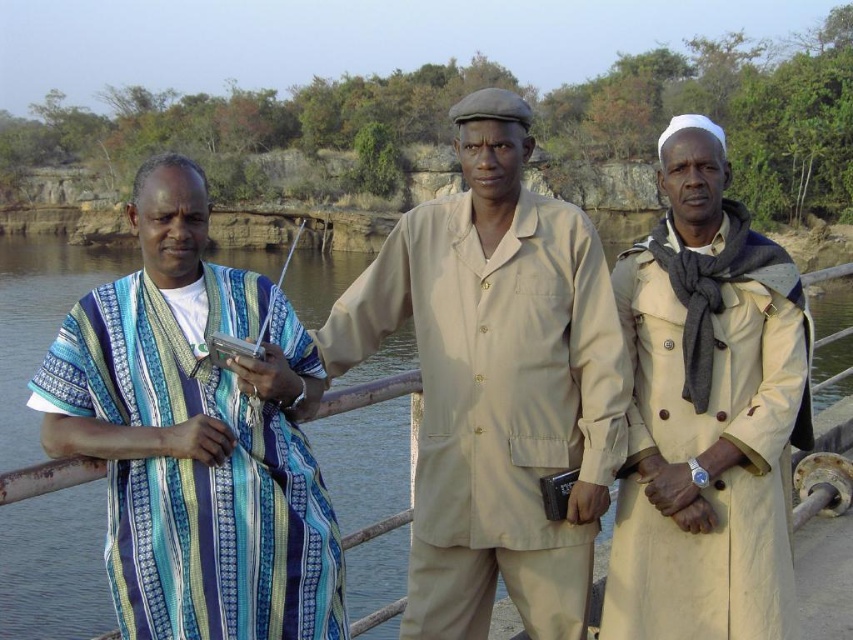
Is beige fabric suit at center thinner than blue striped fabric at left?

Incorrect, beige fabric suit at center's width is not less than blue striped fabric at left's.

Does beige fabric suit at center appear over blue striped fabric at left?

Actually, beige fabric suit at center is below blue striped fabric at left.

I want to click on beige fabric suit at center, so click(497, 384).

Is beige fabric suit at center taller than beige cotton trench coat at right?

Correct, beige fabric suit at center is much taller as beige cotton trench coat at right.

Which is below, beige fabric suit at center or beige cotton trench coat at right?

beige fabric suit at center

Is point (451, 403) positioned after point (695, 148)?

No.

Find the location of a particular element. The image size is (853, 640). beige fabric suit at center is located at coordinates (497, 384).

Between blue striped fabric at left and beige cotton trench coat at right, which one has less height?

blue striped fabric at left is shorter.

Between point (154, 588) and point (672, 454), which one is positioned behind?

The point (672, 454) is behind.

Measure the distance between point (268, 618) and camera.

A distance of 39.05 feet exists between point (268, 618) and camera.

The width and height of the screenshot is (853, 640). I want to click on blue striped fabric at left, so click(196, 435).